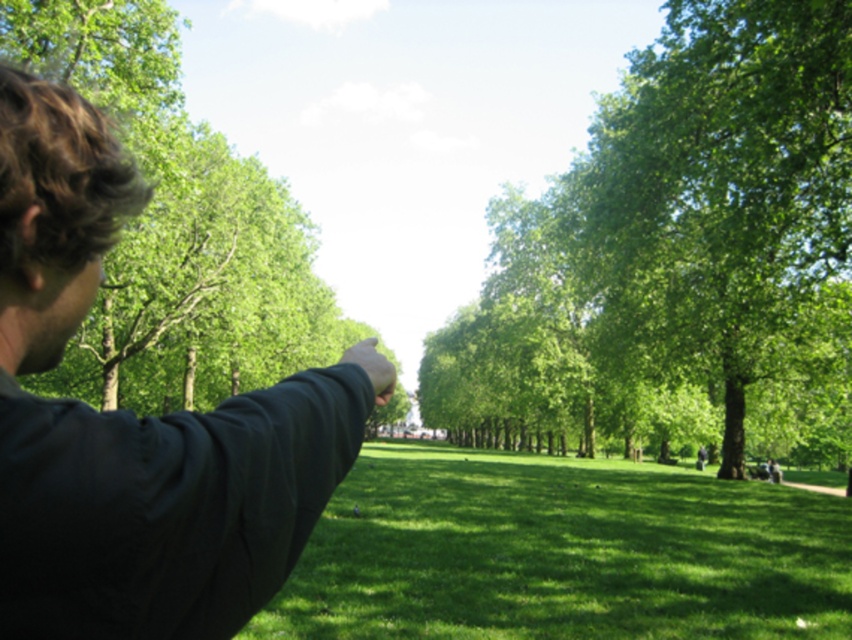
You are standing in the park and see two points marked in the image. Which point is closer to you, point (848, 113) or point (462, 500)?

Point (462, 500) is closer to you because it is less further to the camera than point (848, 113).

You are standing in the park and want to walk towards the green grassy field at center. Which direction should you walk relative to the green leafy tree at center?

The green leafy tree at center is positioned on the right side of the green grassy field at center, so you should walk towards the left side of the green leafy tree at center to reach the green grassy field at center.